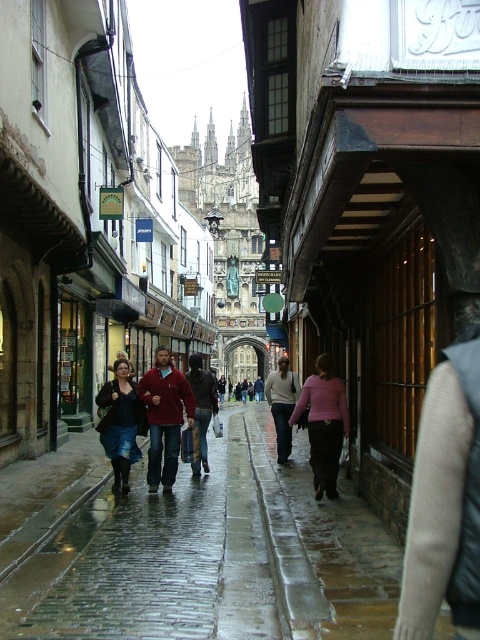
Question: Which point is closer to the camera?

Choices:
 (A) (167, 483)
 (B) (315, 477)
 (C) (127, 422)

Answer: (B)

Question: Which point is farther to the camera?

Choices:
 (A) (109, 412)
 (B) (331, 397)
 (C) (194, 369)

Answer: (C)

Question: Which is farther from the dark brown leather jacket at center?

Choices:
 (A) light beige sweater at center
 (B) blue denim skirt at center
 (C) maroon fleece jacket at center
 (D) pink matte sweater at center

Answer: (D)

Question: Does maroon fleece jacket at center appear over pink matte sweater at center?

Choices:
 (A) no
 (B) yes

Answer: (B)

Question: Can you confirm if pink matte sweater at center is bigger than dark brown leather jacket at center?

Choices:
 (A) no
 (B) yes

Answer: (A)

Question: In this image, where is blue denim skirt at center located relative to light beige sweater at center?

Choices:
 (A) right
 (B) left

Answer: (B)